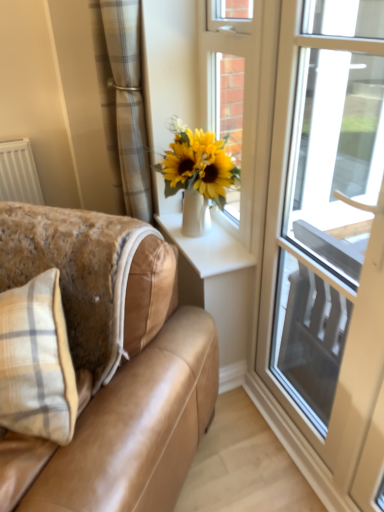
Question: Is white glossy door at upper center completely or partially outside of white glossy vase at upper center?

Choices:
 (A) no
 (B) yes

Answer: (B)

Question: Does white glossy door at upper center appear on the left side of white glossy vase at upper center?

Choices:
 (A) yes
 (B) no

Answer: (B)

Question: Considering the relative sizes of white glossy door at upper center and white glossy vase at upper center in the image provided, is white glossy door at upper center shorter than white glossy vase at upper center?

Choices:
 (A) yes
 (B) no

Answer: (B)

Question: From a real-world perspective, is white glossy door at upper center below white glossy vase at upper center?

Choices:
 (A) yes
 (B) no

Answer: (B)

Question: Can you confirm if white glossy door at upper center is thinner than white glossy vase at upper center?

Choices:
 (A) no
 (B) yes

Answer: (B)

Question: Considering the relative positions of white glossy door at upper center and white glossy vase at upper center in the image provided, is white glossy door at upper center to the right of white glossy vase at upper center from the viewer's perspective?

Choices:
 (A) no
 (B) yes

Answer: (B)

Question: Does plaid fabric curtain at upper left have a lesser height compared to tan leather couch at lower left?

Choices:
 (A) yes
 (B) no

Answer: (A)

Question: Does plaid fabric curtain at upper left lie in front of tan leather couch at lower left?

Choices:
 (A) no
 (B) yes

Answer: (A)

Question: Is plaid fabric curtain at upper left completely or partially outside of tan leather couch at lower left?

Choices:
 (A) no
 (B) yes

Answer: (B)

Question: Does plaid fabric curtain at upper left have a greater width compared to tan leather couch at lower left?

Choices:
 (A) no
 (B) yes

Answer: (A)

Question: Considering the relative sizes of plaid fabric curtain at upper left and tan leather couch at lower left in the image provided, is plaid fabric curtain at upper left thinner than tan leather couch at lower left?

Choices:
 (A) yes
 (B) no

Answer: (A)

Question: Is plaid fabric curtain at upper left positioned far away from tan leather couch at lower left?

Choices:
 (A) no
 (B) yes

Answer: (A)

Question: From the image's perspective, is white glossy vase at upper center over transparent glass door at right?

Choices:
 (A) yes
 (B) no

Answer: (A)